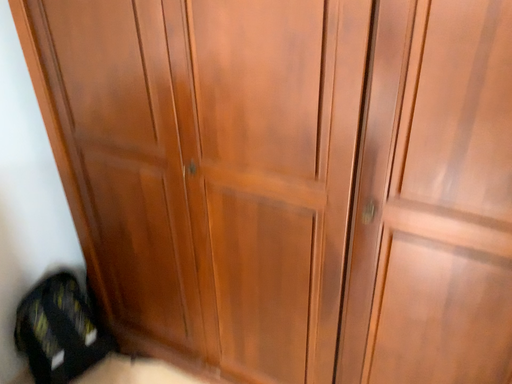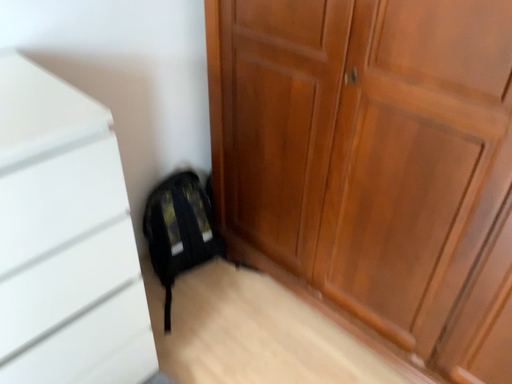
Question: How did the camera likely rotate when shooting the video?

Choices:
 (A) rotated right
 (B) rotated left

Answer: (B)